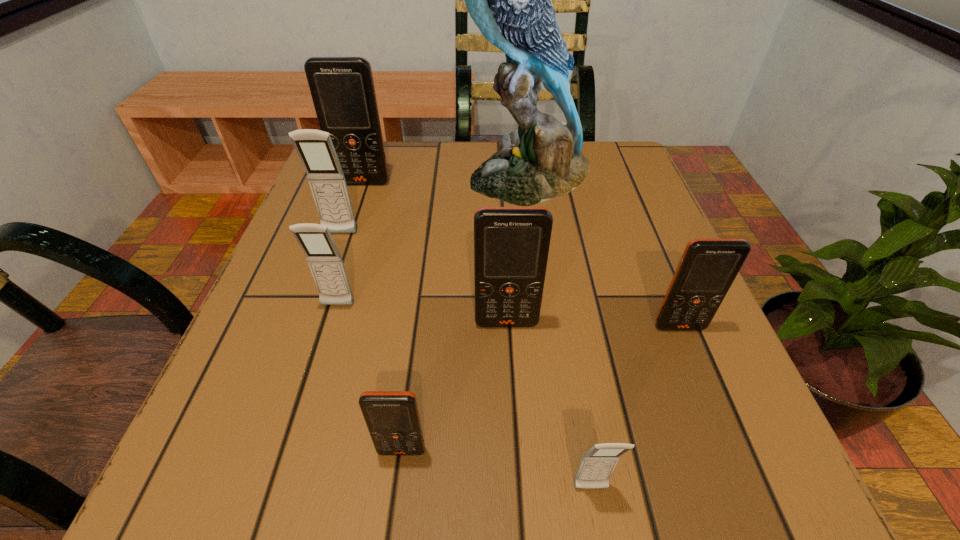
Where is `the third biggest orange cellular telephone`? This screenshot has height=540, width=960. the third biggest orange cellular telephone is located at coordinates (708, 267).

You are a GUI agent. You are given a task and a screenshot of the screen. Output one action in this format:
    pyautogui.click(x=<x>, y=<y>)
    Task: Click on the nearest orange cellular telephone
    
    Given the screenshot: What is the action you would take?
    tap(392, 417)

I want to click on the third orange cellular telephone from right to left, so click(x=392, y=417).

Find the location of a particular element. Image resolution: width=960 pixels, height=540 pixels. the rightmost gray cellular telephone is located at coordinates pos(597,464).

At what (x,y) coordinates should I click in order to perform the action: click on the nearest object. Please return your answer as a coordinate pair (x, y). This screenshot has width=960, height=540. Looking at the image, I should click on (597, 464).

I want to click on free space located 0.160m on the face of the parakeet, so coord(393,175).

Locate an element on the screen. Image resolution: width=960 pixels, height=540 pixels. vacant position located on the face of the parakeet is located at coordinates (401, 175).

Locate an element on the screen. free space located 0.090m on the face of the parakeet is located at coordinates (423, 175).

Identify the location of vacant space located 0.370m on the screen of the tallest cellular telephone. (319, 314).

The height and width of the screenshot is (540, 960). I want to click on vacant space located 0.300m on the front-facing side of the second farthest cellular telephone, so click(x=291, y=372).